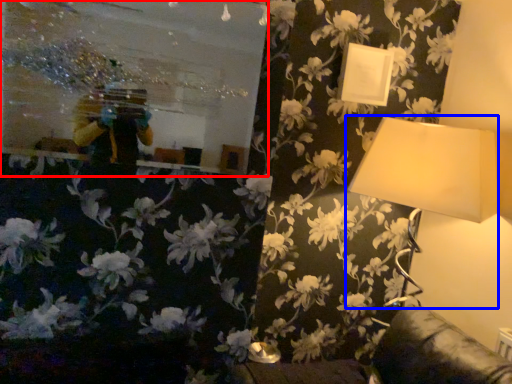
Question: Which object is closer to the camera taking this photo, mirror (highlighted by a red box) or lamp (highlighted by a blue box)?

Choices:
 (A) mirror
 (B) lamp

Answer: (A)